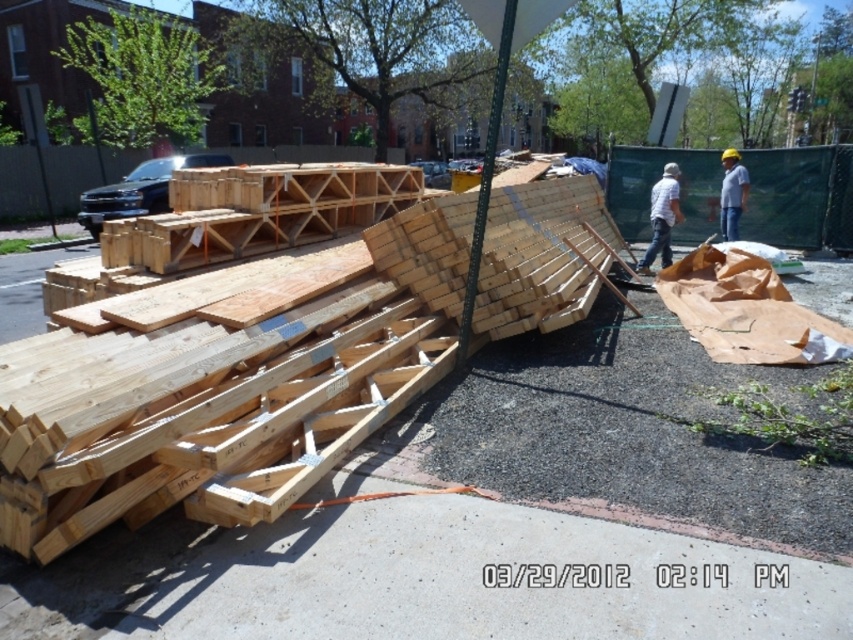
From the picture: Is the position of natural wood boards at center more distant than that of white matte shirt at center?

No.

Is natural wood boards at center smaller than white matte shirt at center?

No, natural wood boards at center is not smaller than white matte shirt at center.

I want to click on natural wood boards at center, so click(x=228, y=394).

The image size is (853, 640). Find the location of `natural wood boards at center`. natural wood boards at center is located at coordinates point(228,394).

Does natural wood at center appear over white matte shirt at center?

No, natural wood at center is not above white matte shirt at center.

What do you see at coordinates (543, 256) in the screenshot? I see `natural wood at center` at bounding box center [543, 256].

You are a GUI agent. You are given a task and a screenshot of the screen. Output one action in this format:
    pyautogui.click(x=<x>, y=<y>)
    Task: Click on the natural wood at center
    
    Given the screenshot: What is the action you would take?
    pyautogui.click(x=543, y=256)

Can you confirm if natural wood boards at center is taller than natural wood at center?

No, natural wood boards at center is not taller than natural wood at center.

Does natural wood boards at center appear on the left side of natural wood at center?

Yes, natural wood boards at center is to the left of natural wood at center.

Is point (297, 394) positioned before point (581, 211)?

That is True.

This screenshot has height=640, width=853. I want to click on natural wood boards at center, so click(x=228, y=394).